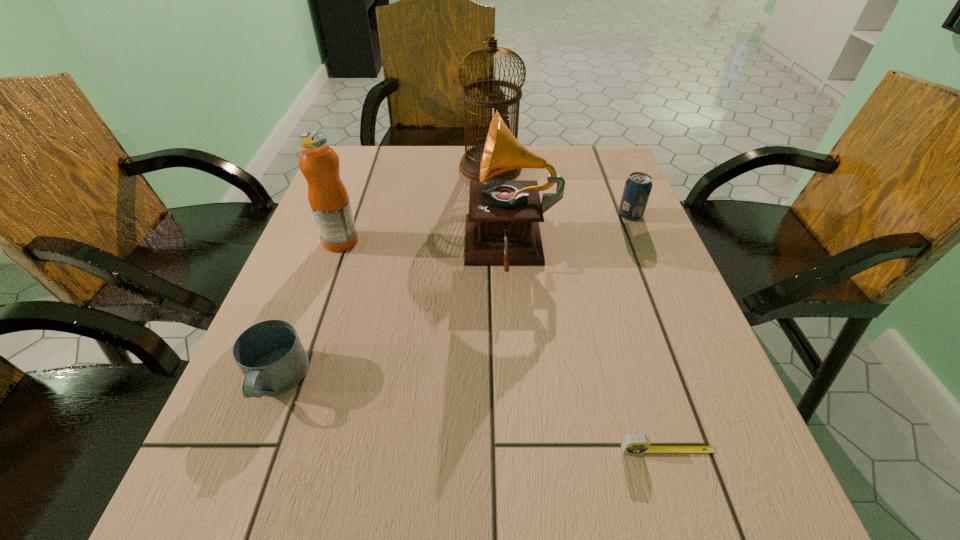
You are a GUI agent. You are given a task and a screenshot of the screen. Output one action in this format:
    pyautogui.click(x=<x>, y=<y>)
    Task: Click on the vacant area that lies between the shortest object and the farthest object
    This screenshot has width=960, height=540.
    Given the screenshot: What is the action you would take?
    pyautogui.click(x=579, y=308)

I want to click on vacant space in between the birdcage and the shortest object, so click(579, 308).

Identify the location of free space between the farthest object and the shortest object. (579, 308).

In order to click on empty location between the mug and the fourth shortest object in this screenshot , I will do `click(308, 310)`.

Where is `vacant region between the second shortest object and the phonograph record`? The image size is (960, 540). vacant region between the second shortest object and the phonograph record is located at coordinates (394, 314).

The height and width of the screenshot is (540, 960). I want to click on blank region between the phonograph record and the shortest object, so click(x=589, y=350).

At what (x,y) coordinates should I click in order to perform the action: click on unoccupied area between the shortest object and the pop soda. Please return your answer as a coordinate pair (x, y). The height and width of the screenshot is (540, 960). Looking at the image, I should click on (649, 333).

Identify which object is located as the fourth nearest to the fourth tallest object. Please provide its 2D coordinates. Your answer should be formatted as a tuple, i.e. [(x, y)], where the tuple contains the x and y coordinates of a point satisfying the conditions above.

[(328, 197)]

This screenshot has height=540, width=960. Find the location of `object that is the third closest to the fifth tallest object`. object that is the third closest to the fifth tallest object is located at coordinates (638, 443).

The image size is (960, 540). Identify the location of free space that satisfies the following two spatial constraints: 1. on the front-facing side of the farthest object; 2. on the front side of the fourth shortest object. (493, 241).